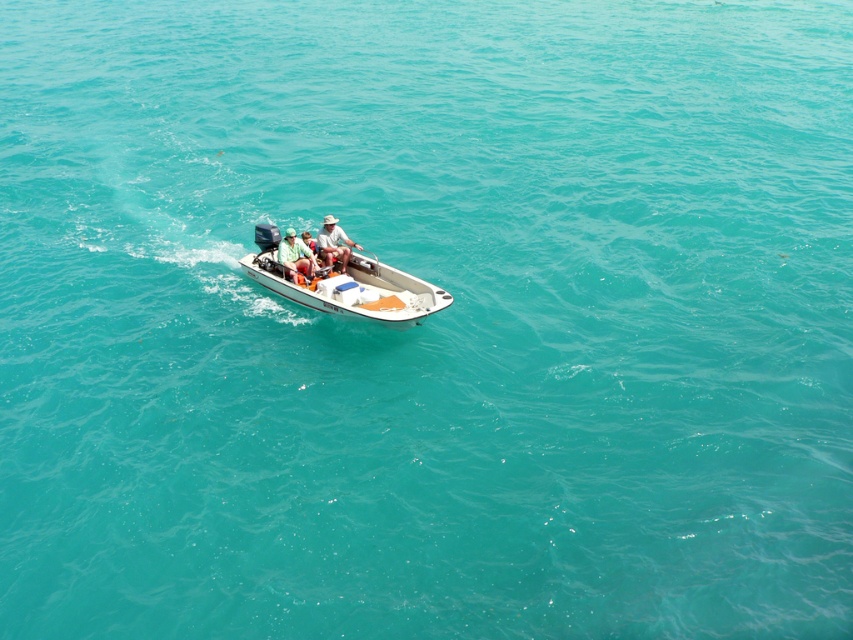
Which is behind, point (329, 214) or point (300, 259)?

Positioned behind is point (329, 214).

Is point (323, 224) closer to camera compared to point (305, 266)?

No, it is not.

Identify the location of tan woven hat at center. The image size is (853, 640). (334, 243).

Based on the photo, does white matte boat at center have a smaller size compared to green fabric shirt at center?

Incorrect, white matte boat at center is not smaller in size than green fabric shirt at center.

Between white matte boat at center and green fabric shirt at center, which one appears on the right side from the viewer's perspective?

From the viewer's perspective, white matte boat at center appears more on the right side.

Is point (367, 273) positioned in front of point (310, 260)?

No, (367, 273) is behind (310, 260).

Locate an element on the screen. white matte boat at center is located at coordinates (340, 282).

Is white matte boat at center behind tan woven hat at center?

No, white matte boat at center is in front of tan woven hat at center.

Can you confirm if white matte boat at center is shorter than tan woven hat at center?

In fact, white matte boat at center may be taller than tan woven hat at center.

Which is in front, point (270, 262) or point (344, 257)?

Point (344, 257) is more forward.

Where is `white matte boat at center`? This screenshot has height=640, width=853. white matte boat at center is located at coordinates (340, 282).